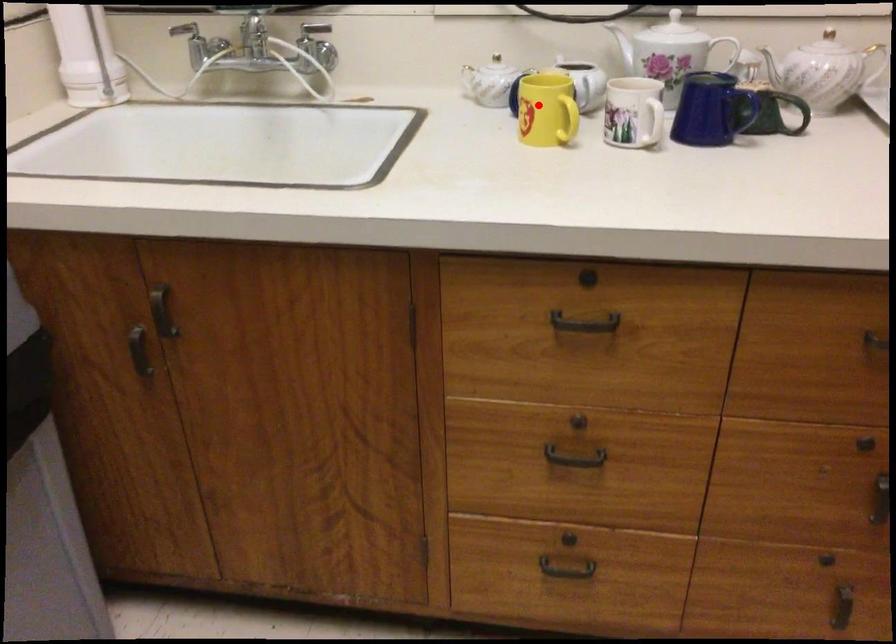
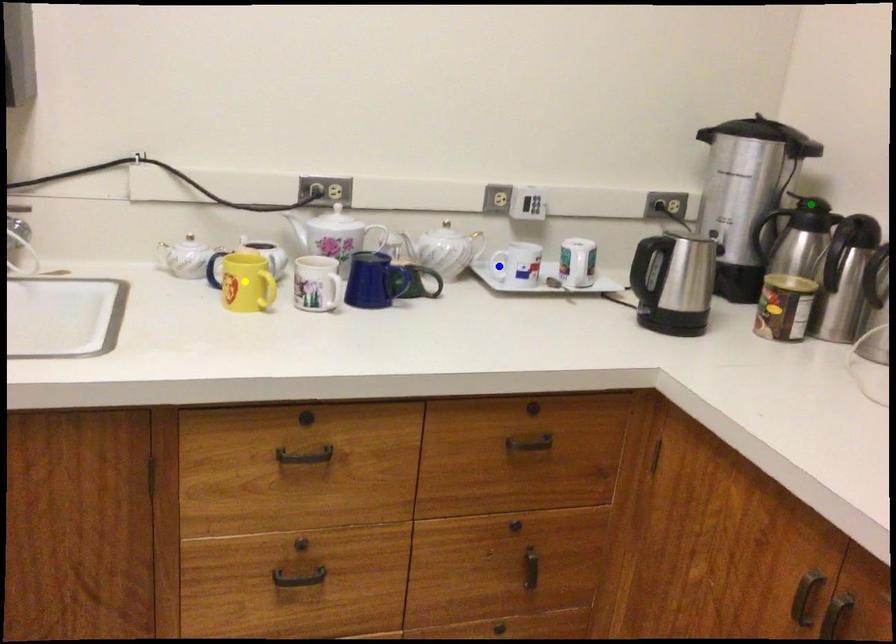
Question: I am providing you with two images of the same scene from different viewpoints. A red point is marked on the first image. You are given multiple points on the second image. Which point in image 2 is actually the same real-world point as the red point in image 1?

Choices:
 (A) green point
 (B) yellow point
 (C) blue point

Answer: (B)